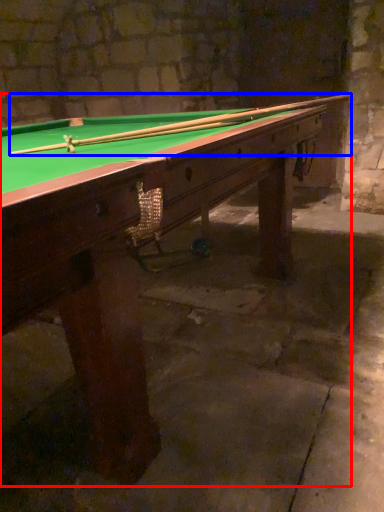
Question: Which object appears closest to the camera in this image, billiard table (highlighted by a red box) or cue (highlighted by a blue box)?

Choices:
 (A) billiard table
 (B) cue

Answer: (A)